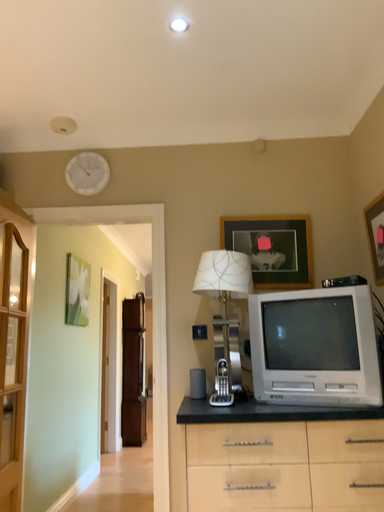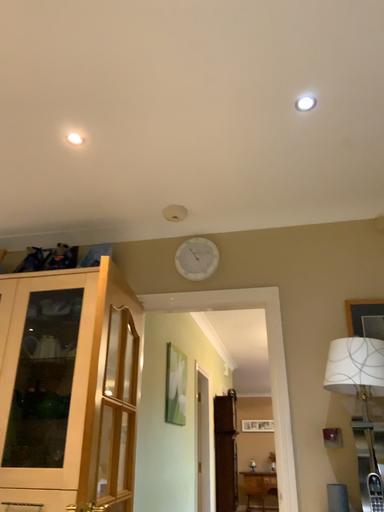
Question: Which way did the camera rotate in the video?

Choices:
 (A) rotated downward
 (B) rotated upward

Answer: (B)